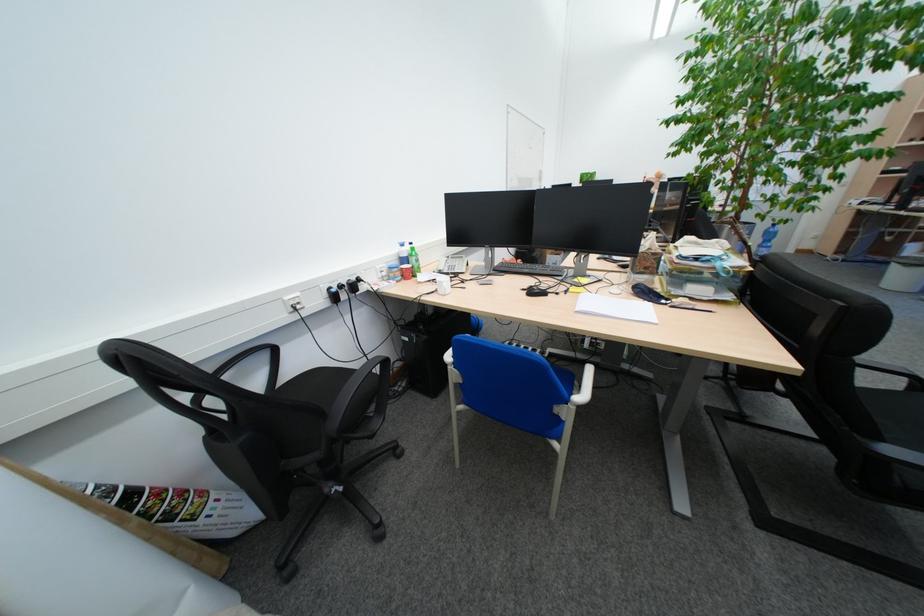
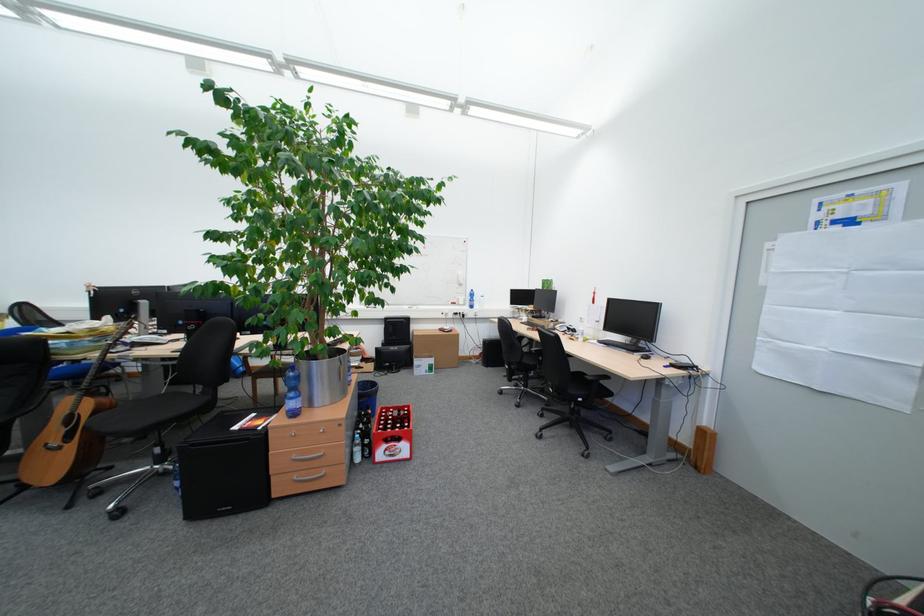
Question: I am providing you with two images of the same scene from different viewpoints. After the viewpoint changes to image2, which objects are now occluded?

Choices:
 (A) computer keyboard
 (B) acoustic guitar
 (C) white freezer handle
 (D) green label bottle

Answer: (D)